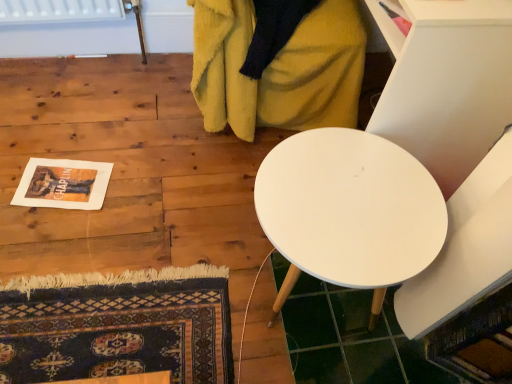
What is the approximate width of soft yellow blanket at upper center?

24.80 inches.

What do you see at coordinates (349, 211) in the screenshot? The height and width of the screenshot is (384, 512). I see `white matte table at center` at bounding box center [349, 211].

In order to click on soft yellow blanket at upper center in this screenshot , I will do `click(277, 64)`.

Is soft yellow blanket at upper center facing towards white matte table at center?

No, soft yellow blanket at upper center is not facing towards white matte table at center.

Are soft yellow blanket at upper center and white matte table at center located far from each other?

soft yellow blanket at upper center is actually quite close to white matte table at center.

Between soft yellow blanket at upper center and white matte table at center, which one has smaller size?

white matte table at center.

From a real-world perspective, between soft yellow blanket at upper center and white matte table at upper right, who is vertically lower?

soft yellow blanket at upper center.

Is soft yellow blanket at upper center facing away from white matte table at upper right?

No, soft yellow blanket at upper center is not facing away from white matte table at upper right.

Is soft yellow blanket at upper center closer to the viewer compared to white matte table at upper right?

No, soft yellow blanket at upper center is further to the viewer.

Is soft yellow blanket at upper center situated inside white matte table at upper right or outside?

soft yellow blanket at upper center exists entirely within white matte table at upper right.

From the picture: Is white matte table at upper right spatially inside white matte table at center, or outside of it?

white matte table at upper right is outside white matte table at center.

Is there a large distance between white matte table at upper right and white matte table at center?

white matte table at upper right is actually quite close to white matte table at center.

Which is less distant, (415, 95) or (387, 221)?

Point (415, 95) is positioned farther from the camera compared to point (387, 221).

Is white matte table at upper right taller or shorter than white matte table at center?

white matte table at upper right is taller than white matte table at center.

From a real-world perspective, between white matte table at center and soft yellow blanket at upper center, who is vertically lower?

white matte table at center is physically lower.

Who is smaller, white matte table at center or soft yellow blanket at upper center?

Smaller between the two is white matte table at center.

Is point (346, 260) positioned before point (208, 51)?

Yes, it is.

Considering the sizes of white matte table at center and soft yellow blanket at upper center in the image, is white matte table at center taller or shorter than soft yellow blanket at upper center?

In the image, white matte table at center appears to be shorter than soft yellow blanket at upper center.

Which of these two, white matte table at center or white matte table at upper right, stands shorter?

white matte table at center.

From a real-world perspective, which object stands above the other?

white matte table at upper right is physically above.

Measure the distance between white matte table at upper right and soft yellow blanket at upper center.

white matte table at upper right is 45.22 centimeters from soft yellow blanket at upper center.

Image resolution: width=512 pixels, height=384 pixels. What are the coordinates of `furniture above the soft yellow blanket at upper center (from a real-world perspective)` in the screenshot? It's located at (446, 83).

Is soft yellow blanket at upper center inside white matte table at upper right?

Yes, soft yellow blanket at upper center is a part of white matte table at upper right.

Is soft yellow blanket at upper center at the back of white matte table at upper right?

Yes, white matte table at upper right is facing away from soft yellow blanket at upper center.

I want to click on desk that is in front of the soft yellow blanket at upper center, so click(x=349, y=211).

Find the location of a particular element. The height and width of the screenshot is (384, 512). blanket that appears behind the white matte table at upper right is located at coordinates (277, 64).

Considering their positions, is white matte table at center positioned closer to soft yellow blanket at upper center than white matte table at upper right?

Based on the image, white matte table at upper right appears to be nearer to soft yellow blanket at upper center.

When comparing their distances from soft yellow blanket at upper center, does white matte table at upper right or white matte table at center seem closer?

white matte table at upper right is positioned closer to the anchor soft yellow blanket at upper center.

From the image, which object appears to be nearer to white matte table at center, white matte table at upper right or soft yellow blanket at upper center?

white matte table at upper right is positioned closer to the anchor white matte table at center.

Considering their positions, is soft yellow blanket at upper center positioned closer to white matte table at center than white matte table at upper right?

Based on the image, white matte table at upper right appears to be nearer to white matte table at center.

Based on their spatial positions, is white matte table at center or soft yellow blanket at upper center further from white matte table at upper right?

Based on the image, soft yellow blanket at upper center appears to be further to white matte table at upper right.

From the image, which object appears to be farther from white matte table at upper right, soft yellow blanket at upper center or white matte table at center?

soft yellow blanket at upper center is further to white matte table at upper right.

Where is `furniture that lies between soft yellow blanket at upper center and white matte table at center from top to bottom`? The height and width of the screenshot is (384, 512). furniture that lies between soft yellow blanket at upper center and white matte table at center from top to bottom is located at coordinates (446, 83).